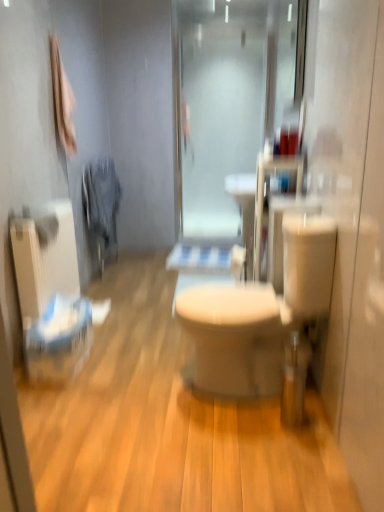
What is the approximate height of beige matte toilet at center?

31.54 inches.

Locate an element on the screen. The image size is (384, 512). white plastic laundry basket at lower left is located at coordinates (59, 340).

Considering the relative sizes of frosted glass shower door at center and white plastic laundry basket at lower left in the image provided, is frosted glass shower door at center taller than white plastic laundry basket at lower left?

Yes.

Does frosted glass shower door at center have a larger size compared to white plastic laundry basket at lower left?

Yes.

Based on the photo, could you tell me if frosted glass shower door at center is turned towards white plastic laundry basket at lower left?

Yes, frosted glass shower door at center is oriented towards white plastic laundry basket at lower left.

Is frosted glass shower door at center touching white plastic laundry basket at lower left?

frosted glass shower door at center and white plastic laundry basket at lower left are clearly separated.

Is white matte toilet paper at center far away from white textured radiator at left?

Absolutely, white matte toilet paper at center is distant from white textured radiator at left.

Who is more distant, white matte toilet paper at center or white textured radiator at left?

white matte toilet paper at center is more distant.

Can you confirm if white matte toilet paper at center is smaller than white textured radiator at left?

Indeed, white matte toilet paper at center has a smaller size compared to white textured radiator at left.

Looking at this image, can you confirm if white matte toilet paper at center is wider than white textured radiator at left?

In fact, white matte toilet paper at center might be narrower than white textured radiator at left.

Is white plastic laundry basket at lower left directly adjacent to white textured radiator at left?

No, white plastic laundry basket at lower left is not next to white textured radiator at left.

How different are the orientations of white plastic laundry basket at lower left and white textured radiator at left in degrees?

The facing directions of white plastic laundry basket at lower left and white textured radiator at left are 4.5 degrees apart.

Is white textured radiator at left inside white plastic laundry basket at lower left?

Actually, white textured radiator at left is outside white plastic laundry basket at lower left.

Does white plastic laundry basket at lower left turn towards white textured radiator at left?

No, white plastic laundry basket at lower left is not turned towards white textured radiator at left.

Which is behind, point (21, 241) or point (133, 370)?

The point (133, 370) is more distant.

Which of these two, white textured radiator at left or white glossy toilet at center, is smaller?

white textured radiator at left.

Looking at this image, measure the distance between white textured radiator at left and white glossy toilet at center.

The distance of white textured radiator at left from white glossy toilet at center is 67.59 centimeters.

From the image's perspective, which one is positioned lower, white textured radiator at left or white glossy toilet at center?

white glossy toilet at center is shown below in the image.

Locate an element on the screen. Image resolution: width=384 pixels, height=512 pixels. plain on the right of white plastic laundry basket at lower left is located at coordinates (168, 423).

Considering the relative sizes of white plastic laundry basket at lower left and white glossy toilet at center in the image provided, is white plastic laundry basket at lower left wider than white glossy toilet at center?

Incorrect, the width of white plastic laundry basket at lower left does not surpass that of white glossy toilet at center.

Is white plastic laundry basket at lower left oriented towards white glossy toilet at center?

No.

Considering the sizes of objects white plastic laundry basket at lower left and white glossy toilet at center in the image provided, who is shorter, white plastic laundry basket at lower left or white glossy toilet at center?

With less height is white glossy toilet at center.

Considering the positions of points (69, 476) and (197, 56), is point (69, 476) farther from camera compared to point (197, 56)?

No, it is in front of (197, 56).

Between white glossy toilet at center and frosted glass shower door at center, which one has larger size?

white glossy toilet at center.

Could you tell me if white glossy toilet at center is facing frosted glass shower door at center?

No, white glossy toilet at center is not oriented towards frosted glass shower door at center.

Is white matte toilet paper at center wider than frosted glass shower door at center?

Yes, white matte toilet paper at center is wider than frosted glass shower door at center.

Is white matte toilet paper at center aimed at frosted glass shower door at center?

No, white matte toilet paper at center is not aimed at frosted glass shower door at center.

From a real-world perspective, is white matte toilet paper at center above or below frosted glass shower door at center?

Clearly, from a real-world perspective, white matte toilet paper at center is below frosted glass shower door at center.

At what (x,y) coordinates should I click in order to perform the action: click on shower door above the white matte toilet paper at center (from a real-world perspective). Please return your answer as a coordinate pair (x, y). Image resolution: width=384 pixels, height=512 pixels. Looking at the image, I should click on (226, 100).

Where is `laundry basket on the left of frosted glass shower door at center`? The height and width of the screenshot is (512, 384). laundry basket on the left of frosted glass shower door at center is located at coordinates (59, 340).

Identify the location of radiator lying below the white matte toilet paper at center (from the image's perspective). This screenshot has height=512, width=384. (44, 256).

In the scene shown: From the image, which object appears to be nearer to beige matte toilet at center, white glossy toilet at center or white matte toilet paper at center?

The object closer to beige matte toilet at center is white glossy toilet at center.

Considering their positions, is white matte toilet paper at center positioned closer to white plastic laundry basket at lower left than beige matte toilet at center?

The object closer to white plastic laundry basket at lower left is beige matte toilet at center.

Estimate the real-world distances between objects in this image. Which object is closer to white glossy toilet at center, beige matte toilet at center or frosted glass shower door at center?

Based on the image, beige matte toilet at center appears to be nearer to white glossy toilet at center.

Considering their positions, is frosted glass shower door at center positioned further to white plastic laundry basket at lower left than beige matte toilet at center?

frosted glass shower door at center is positioned further to the anchor white plastic laundry basket at lower left.

From the image, which object appears to be nearer to beige matte toilet at center, white plastic laundry basket at lower left or frosted glass shower door at center?

white plastic laundry basket at lower left.

Based on their spatial positions, is white glossy toilet at center or beige matte toilet at center closer to white plastic laundry basket at lower left?

white glossy toilet at center lies closer to white plastic laundry basket at lower left than the other object.

When comparing their distances from beige matte toilet at center, does white matte toilet paper at center or white plastic laundry basket at lower left seem further?

white plastic laundry basket at lower left is further to beige matte toilet at center.

Considering their positions, is frosted glass shower door at center positioned further to white matte toilet paper at center than beige matte toilet at center?

frosted glass shower door at center is positioned further to the anchor white matte toilet paper at center.

The height and width of the screenshot is (512, 384). Find the location of `toilet between white glossy toilet at center and frosted glass shower door at center from front to back`. toilet between white glossy toilet at center and frosted glass shower door at center from front to back is located at coordinates (256, 320).

This screenshot has width=384, height=512. I want to click on plain located between white textured radiator at left and beige matte toilet at center in the left-right direction, so click(x=168, y=423).

Find the location of a particular element. This screenshot has height=512, width=384. plain located between white plastic laundry basket at lower left and beige matte toilet at center in the left-right direction is located at coordinates (168, 423).

I want to click on toilet between white glossy toilet at center and white matte toilet paper at center along the z-axis, so click(x=256, y=320).